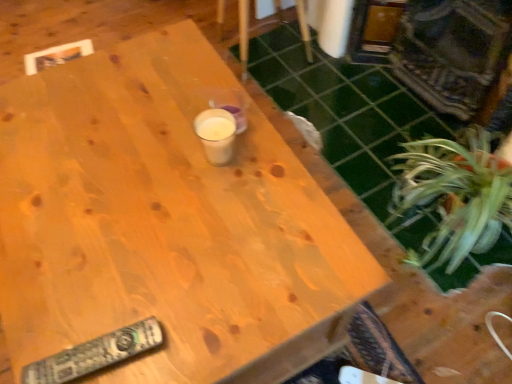
The width and height of the screenshot is (512, 384). I want to click on empty space that is ontop of wooden table at center (from a real-world perspective), so click(x=124, y=208).